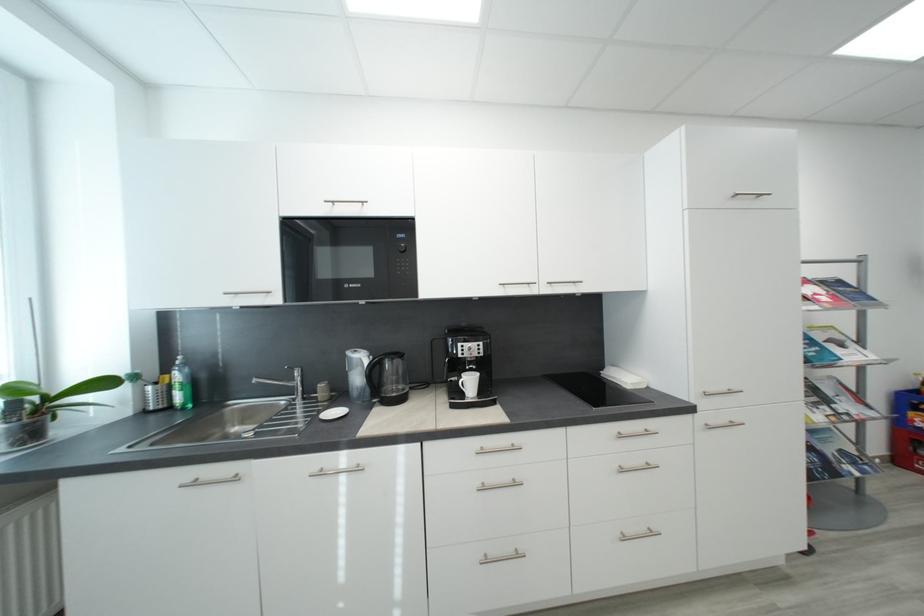
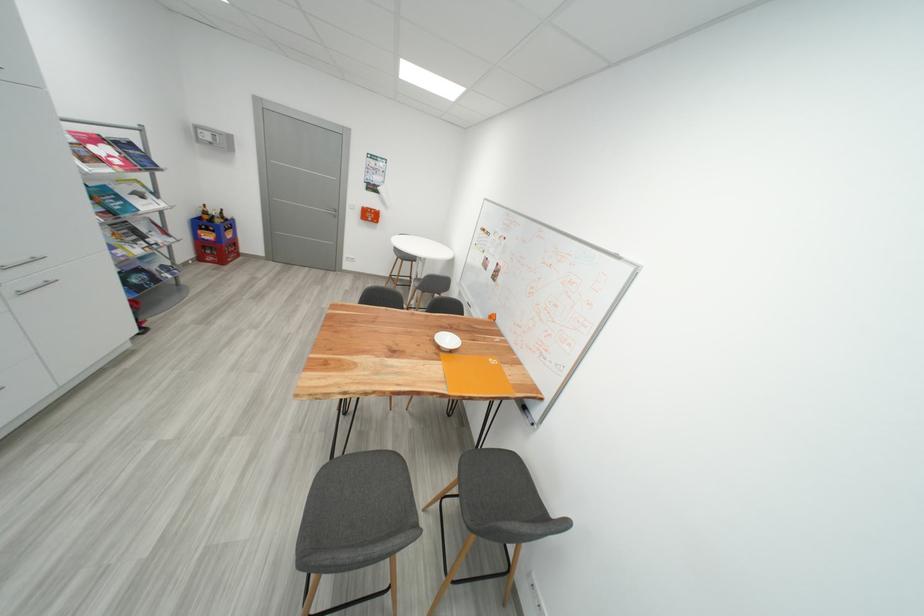
Locate, in the second image, the point that corresponds to point 809,300 in the first image.

(104, 161)